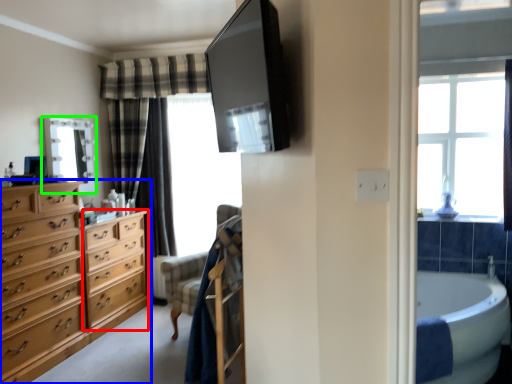
Question: Based on their relative distances, which object is nearer to cabinetry (highlighted by a red box)? Choose from chest of drawers (highlighted by a blue box) and mirror (highlighted by a green box).

Choices:
 (A) chest of drawers
 (B) mirror

Answer: (A)